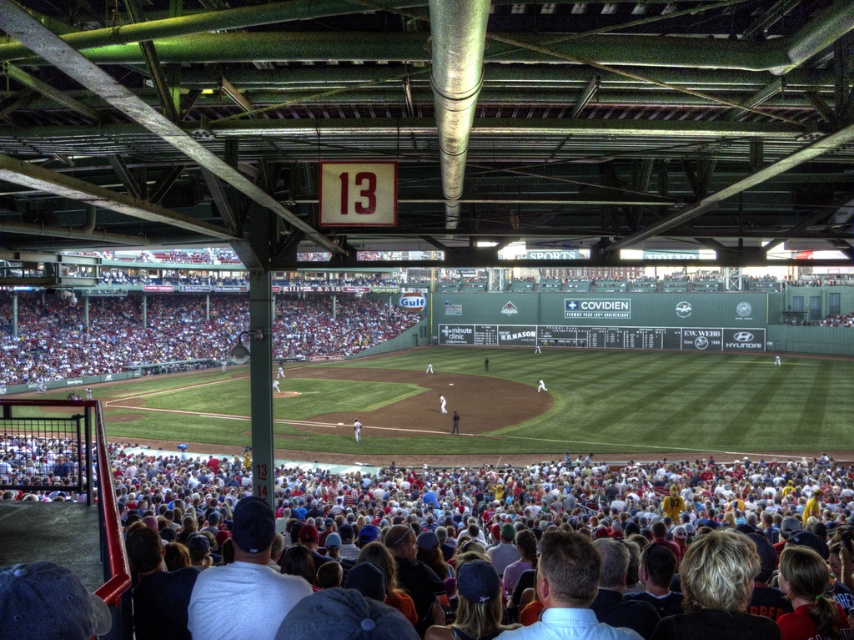
Between point (354, 420) and point (539, 388), which one is positioned behind?

Point (539, 388)

The width and height of the screenshot is (854, 640). What do you see at coordinates (355, 429) in the screenshot?
I see `white uniformed player at center` at bounding box center [355, 429].

Is point (355, 420) positioned before point (537, 388)?

Yes, it is.

Find the location of `white uniformed player at center`. white uniformed player at center is located at coordinates (355, 429).

Is dark brown leather jacket at center taller than white uniform at center?

No.

You are a GUI agent. You are given a task and a screenshot of the screen. Output one action in this format:
    pyautogui.click(x=<x>, y=<y>)
    Task: Click on the dark brown leather jacket at center
    The height and width of the screenshot is (640, 854).
    Given the screenshot: What is the action you would take?
    pyautogui.click(x=454, y=422)

The height and width of the screenshot is (640, 854). Find the location of `dark brown leather jacket at center`. dark brown leather jacket at center is located at coordinates (454, 422).

The width and height of the screenshot is (854, 640). I want to click on dark brown leather jacket at center, so click(x=454, y=422).

Between white jersey baseball team at lower center and white fabric cap at center, which one appears on the right side from the viewer's perspective?

white fabric cap at center is more to the right.

Describe the element at coordinates (572, 500) in the screenshot. I see `white jersey baseball team at lower center` at that location.

This screenshot has width=854, height=640. What do you see at coordinates (572, 500) in the screenshot?
I see `white jersey baseball team at lower center` at bounding box center [572, 500].

You are a GUI agent. You are given a task and a screenshot of the screen. Output one action in this format:
    pyautogui.click(x=<x>, y=<y>)
    Task: Click on the white jersey baseball team at lower center
    The width and height of the screenshot is (854, 640).
    Given the screenshot: What is the action you would take?
    pyautogui.click(x=572, y=500)